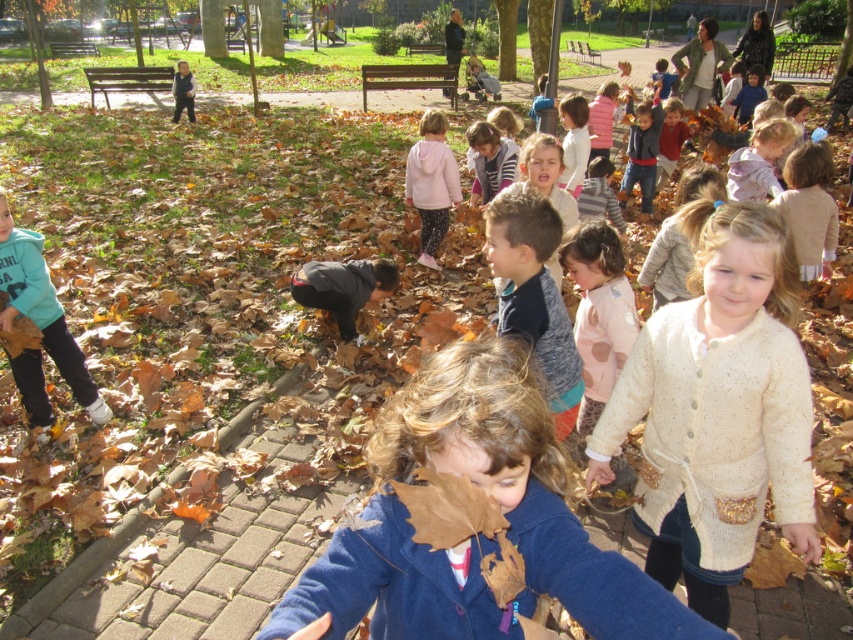
Based on the photo, you are a photographer trying to capture a group photo of the children in the park. You notice two children wearing the white knitted sweater at center and the pink fleece jacket at center. Based on their clothing sizes, which child would you estimate to be younger?

The white knitted sweater at center has a smaller size compared to the pink fleece jacket at center, so the child wearing the white knitted sweater at center is likely younger.

You are a photographer standing in the park and want to take a photo of the matte teal hoodie at lower left and the pink fleece jacket at center. Which of the two objects is closer to you?

The matte teal hoodie at lower left is closer to the viewer than the pink fleece jacket at center.

In the scene shown: You are a photographer trying to capture a photo of the pink fleece jacket at center without including the matte teal hoodie at lower left. Based on their positions, is this possible?

The matte teal hoodie at lower left is to the left of the pink fleece jacket at center, so if you position yourself to the right of the pink fleece jacket at center and frame the shot to exclude the left side, you can capture the pink fleece jacket at center without including the matte teal hoodie at lower left.